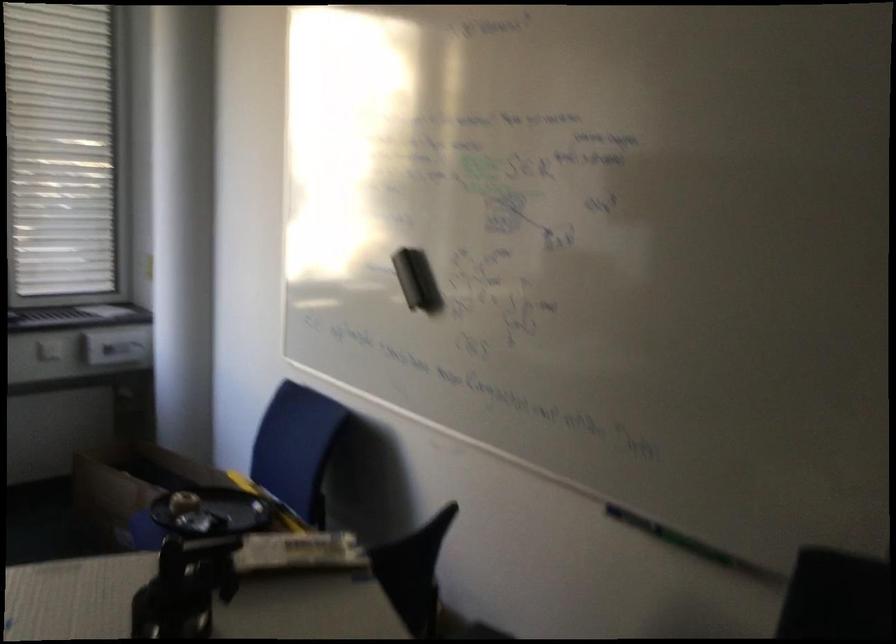
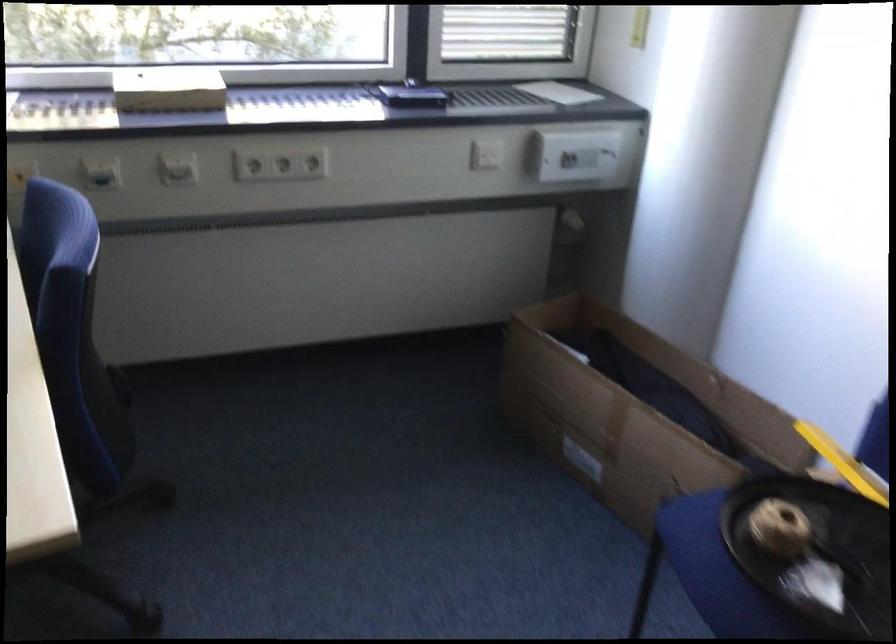
Find the pixel in the second image that matches [113,345] in the first image.

(576, 155)